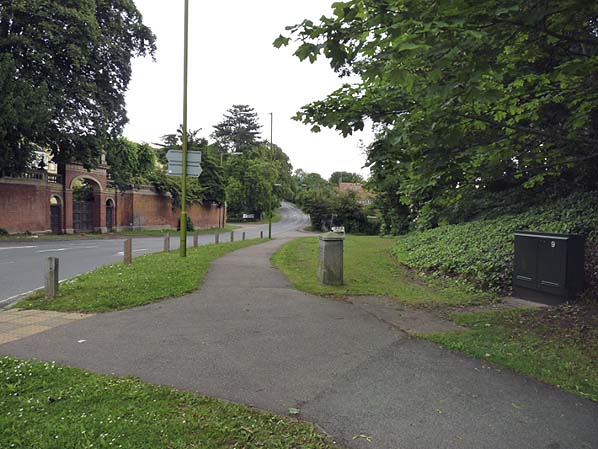
Identify the location of brick wall. (26, 200), (140, 215), (199, 215).